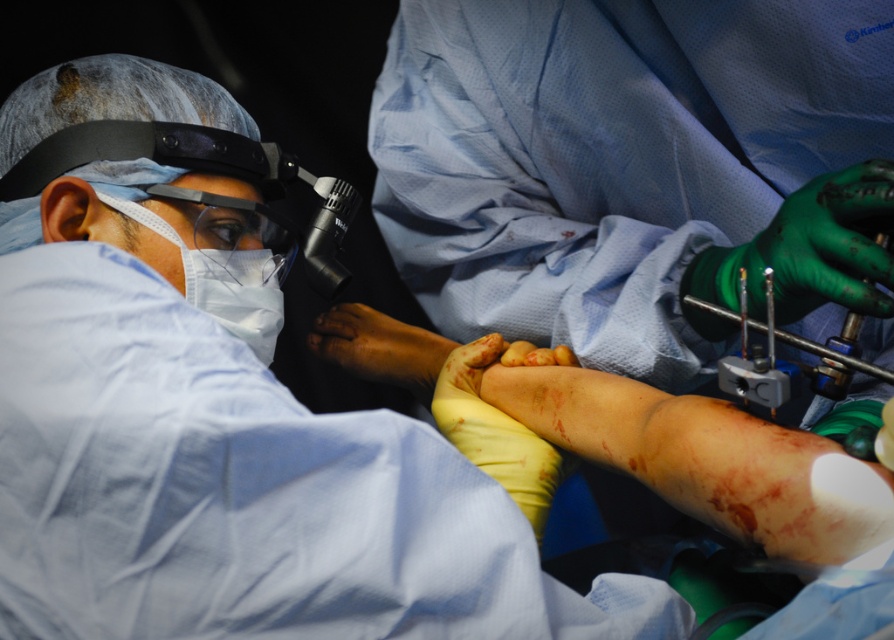
Question: Which point is closer to the camera?

Choices:
 (A) white matte mask at left
 (B) white matte mask at center
 (C) metallic gray surgical instrument at center-right

Answer: (C)

Question: Which point is closer to the camera?

Choices:
 (A) (884, 241)
 (B) (197, 288)

Answer: (A)

Question: Does white matte mask at center have a lesser width compared to white matte mask at left?

Choices:
 (A) no
 (B) yes

Answer: (B)

Question: Can you confirm if metallic gray surgical instrument at center-right is positioned to the left of white matte mask at left?

Choices:
 (A) yes
 (B) no

Answer: (B)

Question: Can you confirm if white matte mask at center is smaller than white matte mask at left?

Choices:
 (A) yes
 (B) no

Answer: (A)

Question: Which point is farther from the camera taking this photo?

Choices:
 (A) (199, 268)
 (B) (150, 227)

Answer: (A)